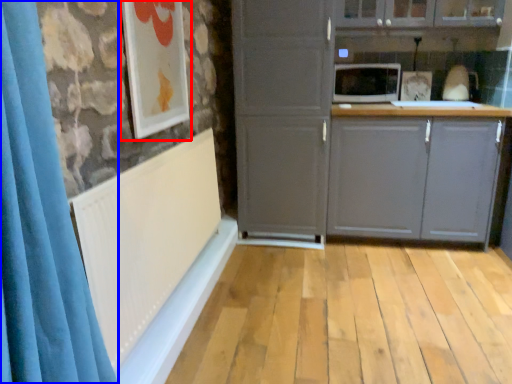
Question: Among these objects, which one is farthest to the camera, picture frame (highlighted by a red box) or shower curtain (highlighted by a blue box)?

Choices:
 (A) picture frame
 (B) shower curtain

Answer: (A)